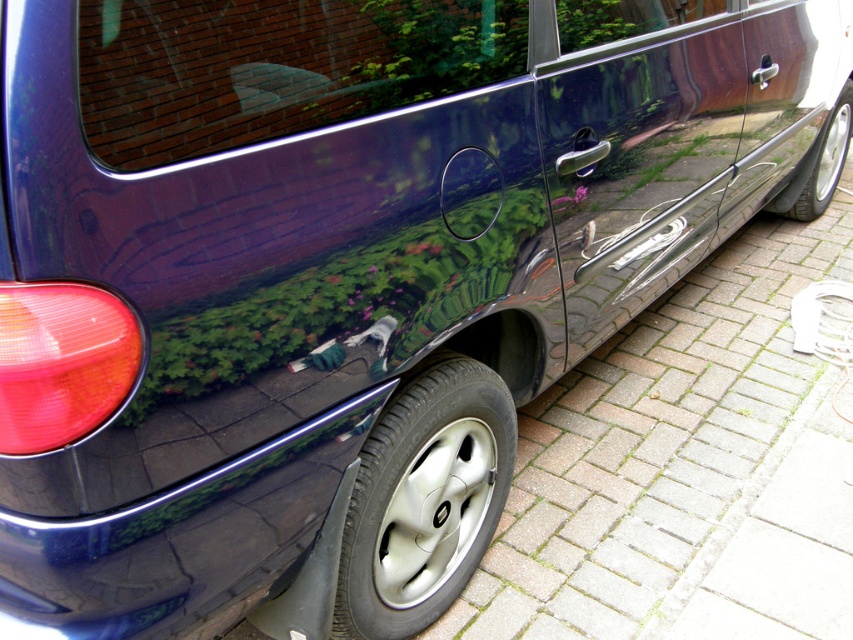
Looking at this image, you are standing behind a dark car and notice two tires. The silver metallic tire at lower right and the shiny metallic tire at right. Which tire is positioned more to the left?

The silver metallic tire at lower right is positioned more to the left compared to the shiny metallic tire at right.

You are standing behind the dark car and want to check the tire condition. Which tire is closer to you, the silver metallic tire at lower right or the shiny metallic tire at right?

The silver metallic tire at lower right is closer to you because it is in front of the shiny metallic tire at right.

You are a mechanic checking the tires of the car. You notice two tires on the right side of the car. Which tire has a wider tread? Please refer to the silver metallic tire at lower right and the shiny metallic tire at right.

The shiny metallic tire at right has a wider tread since the silver metallic tire at lower right is thinner than it.